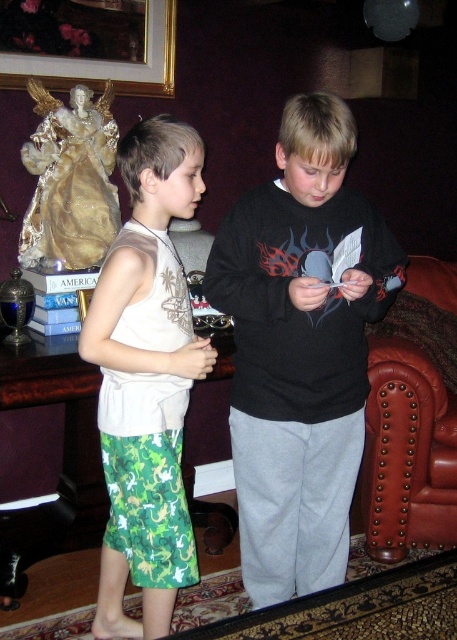
You are a photographer standing at a certain distance from the point marked as point [329,124]. You want to take a photo of the two boys while ensuring that the entire scene is in focus. If your camera has a depth of field that can cover up to 5 feet, will you be able to capture the entire scene clearly?

The distance between the photographer and point [329,124] is 4.77 feet, which is within the camera 5 feet depth of field. Therefore, the entire scene will be in focus.

You are a photographer positioned in the living room and want to take a photo that includes both the black matte sweatshirt at center and the goldmetallicpicture frame at upper left. Which object should you focus on first to ensure both are in clear focus?

The black matte sweatshirt at center is closer to the viewer than the goldmetallicpicture frame at upper left, so you should focus on the black matte sweatshirt at center first to ensure both are in clear focus.